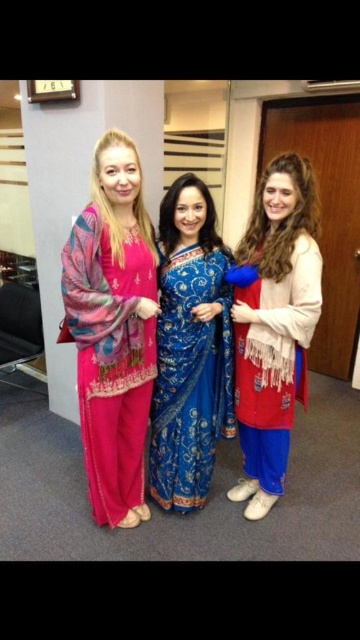
Question: Which object appears farthest from the camera in this image?

Choices:
 (A) blue silk saree at center
 (B) matte red dress at right
 (C) pink embroidered dress at left

Answer: (A)

Question: Which point is closer to the camera?

Choices:
 (A) pink embroidered dress at left
 (B) blue silk saree at center

Answer: (A)

Question: Estimate the real-world distances between objects in this image. Which object is closer to the pink embroidered dress at left?

Choices:
 (A) blue silk saree at center
 (B) matte red dress at right

Answer: (A)

Question: Does matte red dress at right have a greater width compared to blue silk saree at center?

Choices:
 (A) yes
 (B) no

Answer: (B)

Question: Is the position of pink embroidered dress at left less distant than that of matte red dress at right?

Choices:
 (A) no
 (B) yes

Answer: (B)

Question: Does pink embroidered dress at left appear over matte red dress at right?

Choices:
 (A) yes
 (B) no

Answer: (A)